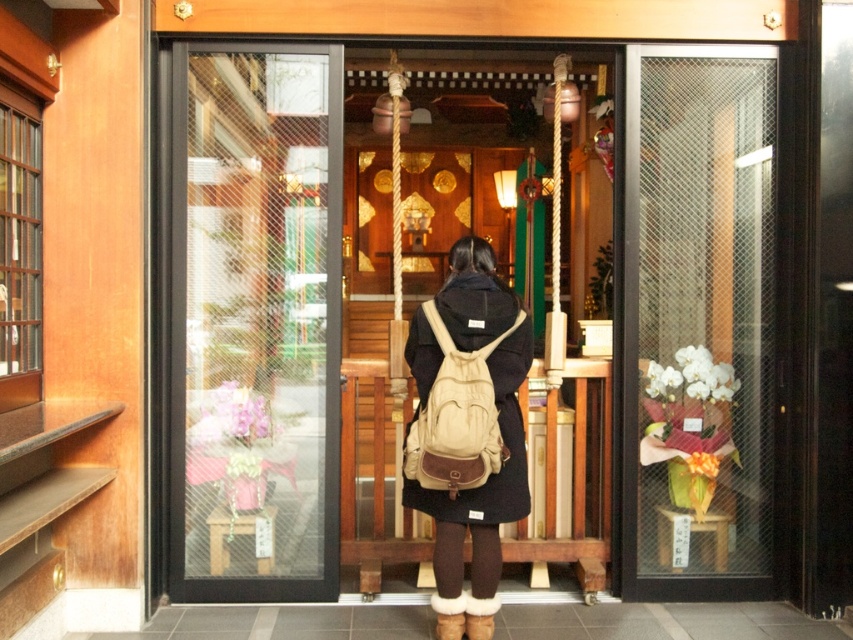
You are a visitor at the shrine entrance and want to place your beige canvas backpack at center on the floor near the clear glass door at right. Given that the backpack requires 1 meter of space to be placed safely, can you fit it there?

The clear glass door at right is 1.21 meters away from the beige canvas backpack at center. Since the required space is 1 meter, the distance is sufficient to safely place the backpack there.

You are standing at the entrance of a traditional Japanese shrine. You notice two points marked on the floor. One is at coordinates point (746, 60) and the other is at point (241, 342). If you want to move towards the point that is further away from the entrance, which coordinate should you head towards?

Point (746, 60) is behind point (241, 342), so you should head towards point (746, 60) to move towards the point further away from the entrance.

You are standing in front of the entrance of a traditional Japanese shrine. You see a matte black elevator at center and a transparent glass door at center. Which one is wider?

The matte black elevator at center might be wider than transparent glass door at center.